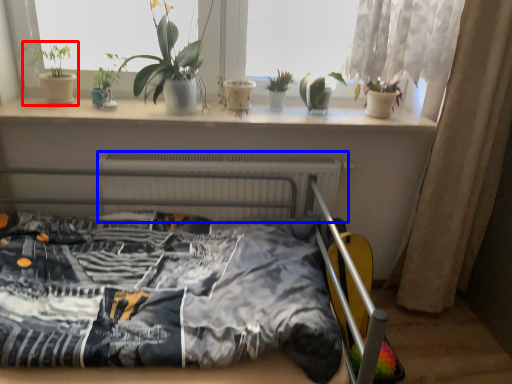
Question: Which object appears farthest to the camera in this image, houseplant (highlighted by a red box) or radiator (highlighted by a blue box)?

Choices:
 (A) houseplant
 (B) radiator

Answer: (B)